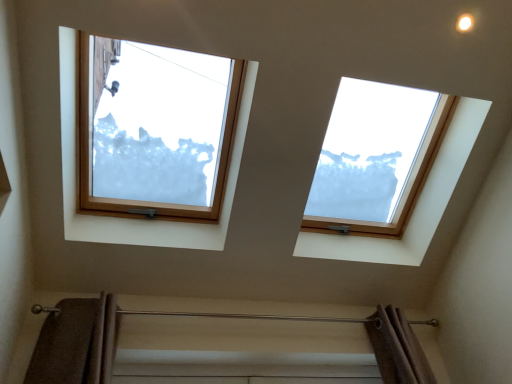
The height and width of the screenshot is (384, 512). Describe the element at coordinates (245, 316) in the screenshot. I see `brown fabric towel at lower center` at that location.

You are a GUI agent. You are given a task and a screenshot of the screen. Output one action in this format:
    pyautogui.click(x=<x>, y=<y>)
    Task: Click on the brown fabric towel at lower center
    This screenshot has width=512, height=384.
    Given the screenshot: What is the action you would take?
    pyautogui.click(x=245, y=316)

This screenshot has width=512, height=384. What are the coordinates of `brown fabric towel at lower center` in the screenshot? It's located at (245, 316).